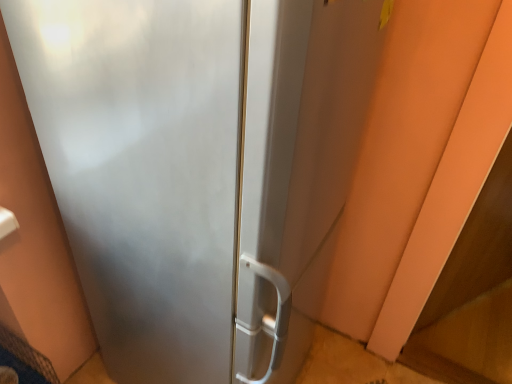
Locate an element on the screen. satin silver refrigerator at center is located at coordinates (173, 175).

Describe the element at coordinates (173, 175) in the screenshot. I see `satin silver refrigerator at center` at that location.

At what (x,y) coordinates should I click in order to perform the action: click on satin silver refrigerator at center. Please return your answer as a coordinate pair (x, y). The height and width of the screenshot is (384, 512). Looking at the image, I should click on (173, 175).